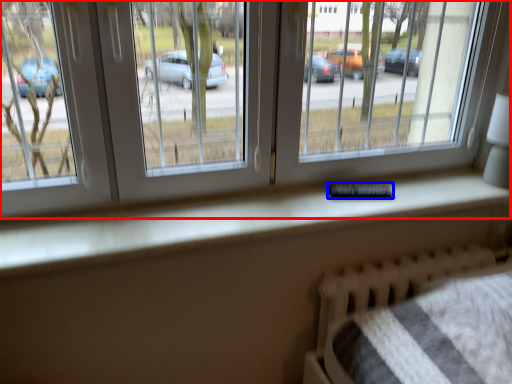
Question: Among these objects, which one is nearest to the camera, window (highlighted by a red box) or remote (highlighted by a blue box)?

Choices:
 (A) window
 (B) remote

Answer: (A)